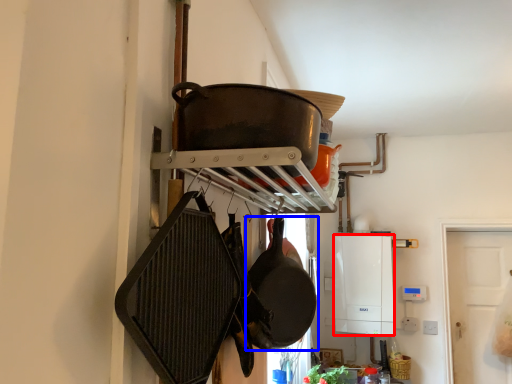
Question: Which object is closer to the camera taking this photo, appliance (highlighted by a red box) or frying pan (highlighted by a blue box)?

Choices:
 (A) appliance
 (B) frying pan

Answer: (B)